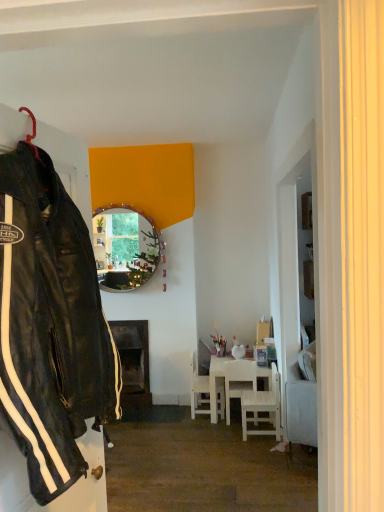
Question: Considering the relative positions of matte circular mirror at center and white wooden chair at lower right, positioned as the third chair in back-to-front order, in the image provided, is matte circular mirror at center to the left or to the right of white wooden chair at lower right, positioned as the third chair in back-to-front order,?

Choices:
 (A) left
 (B) right

Answer: (A)

Question: From the image's perspective, relative to white wooden chair at lower right, positioned as the third chair in back-to-front order, is matte circular mirror at center above or below?

Choices:
 (A) below
 (B) above

Answer: (B)

Question: Based on their relative distances, which object is farther from the dark wood fireplace at center?

Choices:
 (A) matte circular mirror at center
 (B) white wooden chair at lower right, positioned as the third chair in back-to-front order
 (C) white glossy table at center
 (D) black leather jacket at left
 (E) white matte chair at center, placed as the 3th chair when sorted from front to back

Answer: (D)

Question: Which object is the closest to the white wooden chair at lower right, the first chair when ordered from front to back?

Choices:
 (A) white glossy table at center
 (B) matte circular mirror at center
 (C) white wooden chair at center, the second chair in the front-to-back sequence
 (D) white matte chair at center, the 1th chair positioned from the back
 (E) black leather jacket at left

Answer: (C)